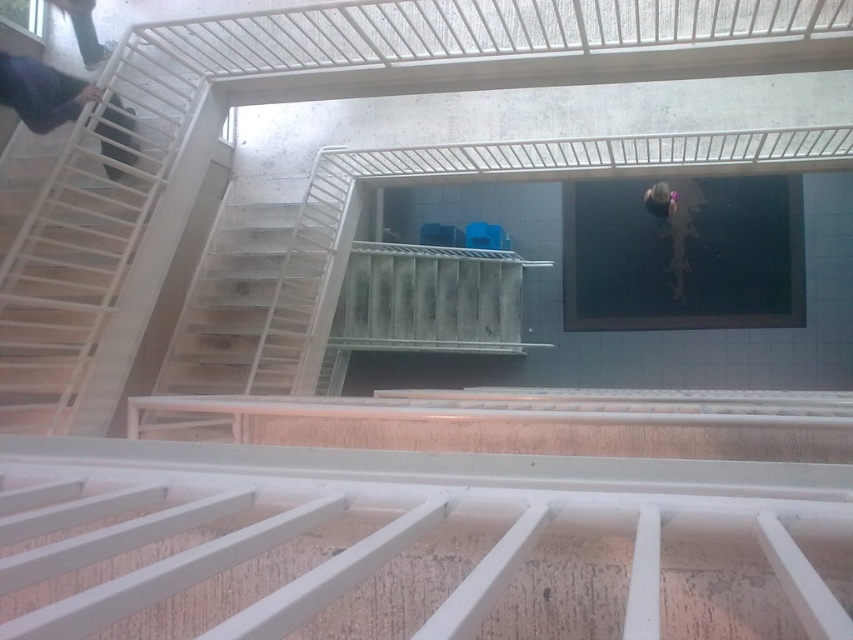
Question: Is the position of dark blue fabric at upper left less distant than that of smooth purple helmet at upper center?

Choices:
 (A) yes
 (B) no

Answer: (A)

Question: Which of the following is the farthest from the observer?

Choices:
 (A) (32, 90)
 (B) (650, 204)

Answer: (B)

Question: Is dark blue fabric at upper left smaller than smooth purple helmet at upper center?

Choices:
 (A) yes
 (B) no

Answer: (B)

Question: Does dark blue fabric at upper left lie in front of smooth purple helmet at upper center?

Choices:
 (A) yes
 (B) no

Answer: (A)